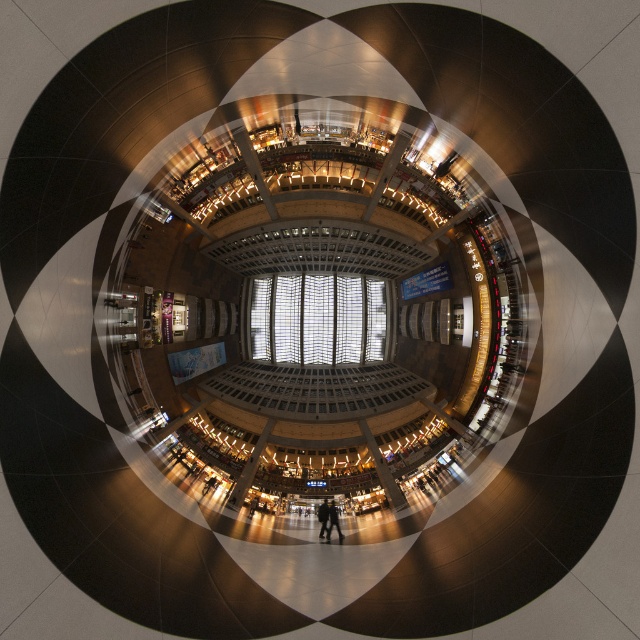
You are standing in the shopping mall atrium and notice two points marked in the image. The first point is at coordinates point (339, 532) and the second is at point (323, 522). Which of these two points is closer to your current position?

Point (339, 532) is closer to the camera than point (323, 522), so the first point is closer to your current position.

You are a security guard in the mall and need to ensure that the dark brown leather jacket at center and the dark clothing at center are not blocking the emergency exit. Which item is wider and might be causing a blockage?

The dark brown leather jacket at center might be wider than dark clothing at center, so it is the one that might be causing the blockage.

You are a store manager organizing a display in the mall atrium. You have two items to place on a mannequin stand at the center of the atrium. The items are the dark brown leather jacket at center and the dark clothing at center. Which item should you choose if you want to create a more prominent display?

The dark brown leather jacket at center has a larger size compared to dark clothing at center, so it would create a more prominent display.